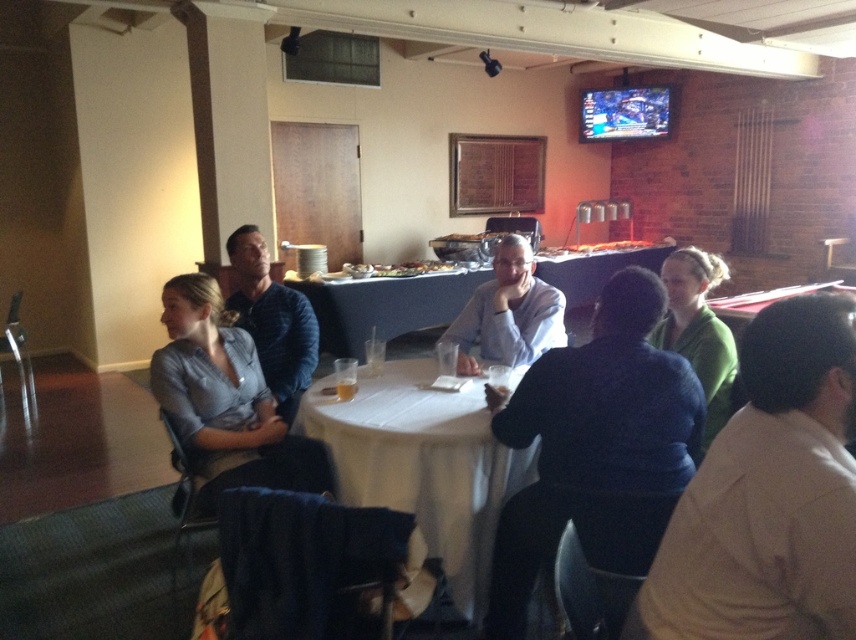
Is blue sweater at center to the right of blue striped polo shirt at center from the viewer's perspective?

Correct, you'll find blue sweater at center to the right of blue striped polo shirt at center.

Does point (596, 314) lie behind point (251, 291)?

No, (596, 314) is in front of (251, 291).

Identify the location of blue sweater at center. Image resolution: width=856 pixels, height=640 pixels. (595, 448).

Between point (627, 404) and point (209, 337), which one is positioned behind?

Positioned behind is point (209, 337).

Is point (607, 301) farther from viewer compared to point (153, 369)?

No.

Is point (550, 534) positioned behind point (192, 291)?

No, it is not.

At what (x,y) coordinates should I click in order to perform the action: click on blue sweater at center. Please return your answer as a coordinate pair (x, y). The image size is (856, 640). Looking at the image, I should click on (595, 448).

I want to click on white shirt at lower right, so click(x=770, y=493).

Between point (685, 532) and point (239, 278), which one is positioned behind?

Point (239, 278)

Does point (849, 401) lie behind point (296, 381)?

No, it is in front of (296, 381).

At what (x,y) coordinates should I click in order to perform the action: click on white shirt at lower right. Please return your answer as a coordinate pair (x, y). The height and width of the screenshot is (640, 856). Looking at the image, I should click on (770, 493).